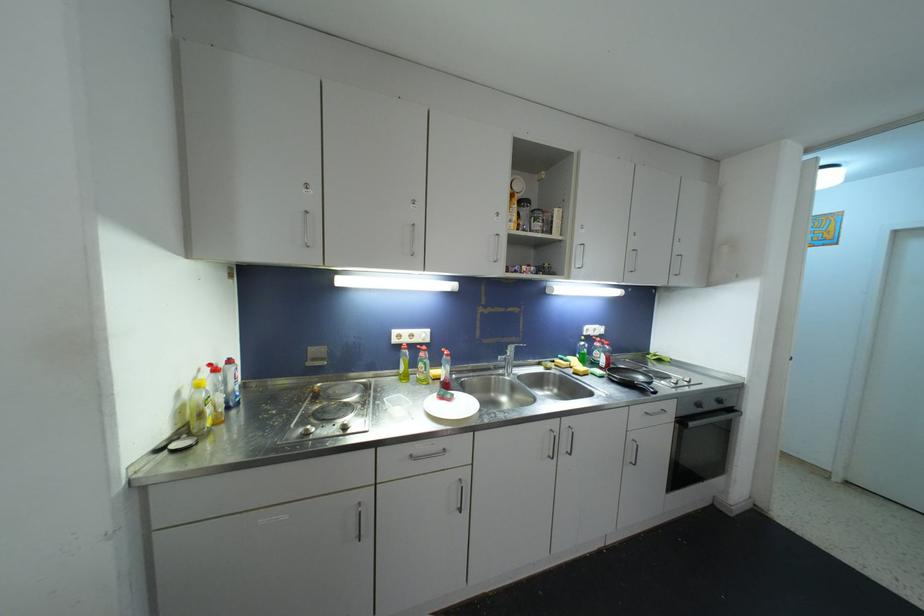
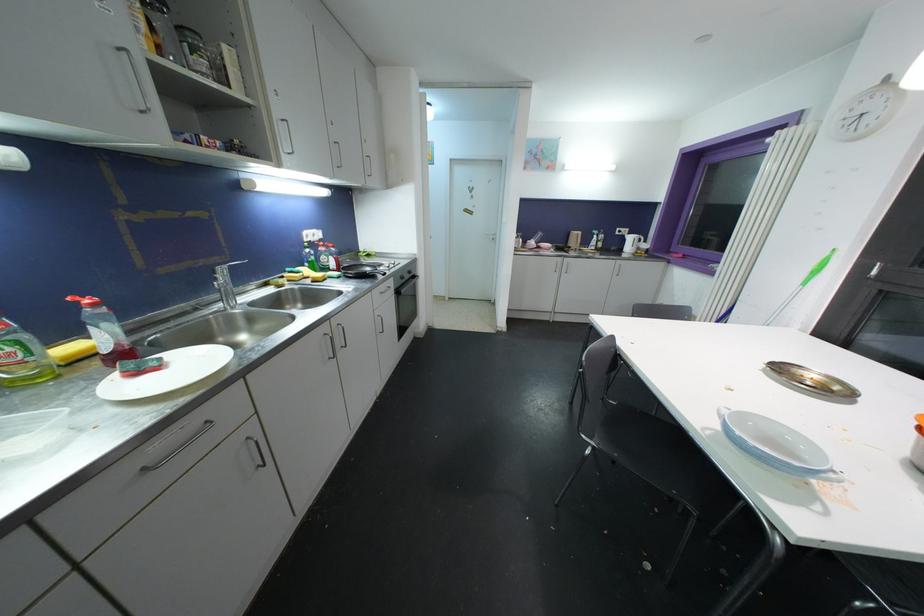
Locate, in the second image, the point that corresponds to [517,349] in the first image.

(228, 270)